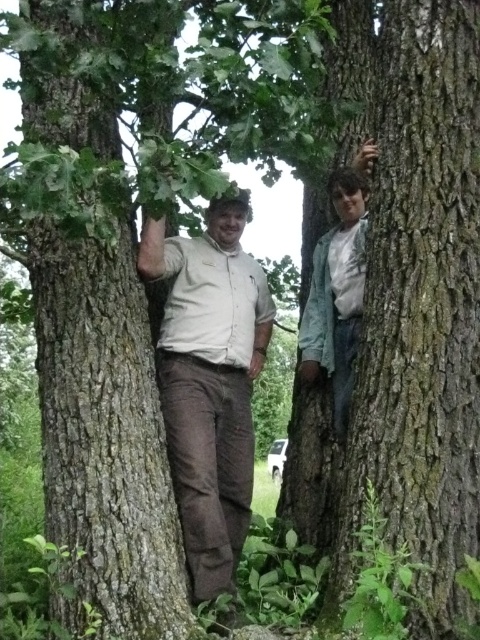
Can you confirm if smooth brown bark at left is shorter than matte khaki shirt at center?

No, smooth brown bark at left is not shorter than matte khaki shirt at center.

Can you confirm if smooth brown bark at left is smaller than matte khaki shirt at center?

Yes.

Is point (99, 582) behind point (250, 404)?

No, it is not.

In order to click on smooth brown bark at left in this screenshot , I will do `click(105, 432)`.

Is smooth brown bark at left wider than green cotton shirt at right?

Indeed, smooth brown bark at left has a greater width compared to green cotton shirt at right.

Is point (108, 376) in front of point (364, 198)?

Yes, point (108, 376) is in front of point (364, 198).

You are a GUI agent. You are given a task and a screenshot of the screen. Output one action in this format:
    pyautogui.click(x=<x>, y=<y>)
    Task: Click on the smooth brown bark at left
    The image size is (480, 640).
    Given the screenshot: What is the action you would take?
    pyautogui.click(x=105, y=432)

Who is more distant from viewer, (154, 241) or (364, 260)?

The point (364, 260) is more distant.

Does point (191, 349) come in front of point (351, 278)?

Yes.

Find the location of `matte khaki shirt at center`. matte khaki shirt at center is located at coordinates (210, 381).